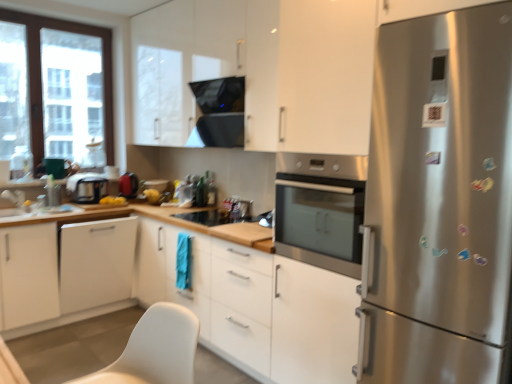
Where is `white plastic table at lower left`? Image resolution: width=512 pixels, height=384 pixels. white plastic table at lower left is located at coordinates (10, 367).

What are the coordinates of `clear glass window at left` in the screenshot? It's located at (45, 74).

Is point (190, 31) positioned after point (35, 225)?

Yes, it is behind point (35, 225).

Is white glossy cabinet at upper center, which ranks as the 1th cabinetry in top-to-bottom order, looking in the opposite direction of white matte cabinet at lower left, marked as the 2th cabinetry in a bottom-to-top arrangement?

white glossy cabinet at upper center, which ranks as the 1th cabinetry in top-to-bottom order, is not turned away from white matte cabinet at lower left, marked as the 2th cabinetry in a bottom-to-top arrangement.

Is white glossy cabinet at upper center, which ranks as the 1th cabinetry in top-to-bottom order, situated inside white matte cabinet at lower left, acting as the third cabinetry starting from the top, or outside?

white glossy cabinet at upper center, which ranks as the 1th cabinetry in top-to-bottom order, is located beyond the bounds of white matte cabinet at lower left, acting as the third cabinetry starting from the top.

From the image's perspective, between black glass exhaust hood at upper center and white glossy sink at lower left, who is located below?

From the image's view, white glossy sink at lower left is below.

Is the surface of black glass exhaust hood at upper center in direct contact with white glossy sink at lower left?

black glass exhaust hood at upper center and white glossy sink at lower left are clearly separated.

Is point (219, 101) behind point (29, 203)?

No, (219, 101) is closer to viewer.

Image resolution: width=512 pixels, height=384 pixels. I want to click on exhaust hood in front of the white glossy sink at lower left, so click(220, 111).

Does white matte cabinet at lower left, acting as the third cabinetry starting from the top, have a lesser height compared to stainless steel oven at center?

In fact, white matte cabinet at lower left, acting as the third cabinetry starting from the top, may be taller than stainless steel oven at center.

Considering the positions of objects white matte cabinet at lower left, acting as the third cabinetry starting from the top, and stainless steel oven at center in the image provided, who is more to the left, white matte cabinet at lower left, acting as the third cabinetry starting from the top, or stainless steel oven at center?

white matte cabinet at lower left, acting as the third cabinetry starting from the top.

From a real-world perspective, which cabinetry is the 1st one underneath the stainless steel oven at center? Please provide its 2D coordinates.

[(71, 273)]

From a real-world perspective, is matte black toaster at left, which is the second appliance from right to left, positioned above or below white matte cabinet at center, the first cabinetry ordered from the bottom?

matte black toaster at left, which is the second appliance from right to left, is above white matte cabinet at center, the first cabinetry ordered from the bottom.

How much distance is there between matte black toaster at left, which is the second appliance from right to left, and white matte cabinet at center, the fourth cabinetry viewed from the top?

A distance of 1.50 meters exists between matte black toaster at left, which is the second appliance from right to left, and white matte cabinet at center, the fourth cabinetry viewed from the top.

Is matte black toaster at left, placed as the first appliance when sorted from left to right, outside of white matte cabinet at center, the first cabinetry ordered from the bottom?

matte black toaster at left, placed as the first appliance when sorted from left to right, is positioned outside white matte cabinet at center, the first cabinetry ordered from the bottom.

Is the position of matte black toaster at left, placed as the first appliance when sorted from left to right, less distant than that of white matte cabinet at center, the first cabinetry ordered from the bottom?

No, it is behind white matte cabinet at center, the first cabinetry ordered from the bottom.

Considering the positions of objects matte black kettle at left, the first appliance viewed from the right, and white plastic table at lower left in the image provided, who is more to the left, matte black kettle at left, the first appliance viewed from the right, or white plastic table at lower left?

Positioned to the left is matte black kettle at left, the first appliance viewed from the right.

Which is in front, matte black kettle at left, the first appliance viewed from the right, or white plastic table at lower left?

Positioned in front is white plastic table at lower left.

Image resolution: width=512 pixels, height=384 pixels. Find the location of `table below the matte black kettle at left, the first appliance viewed from the right (from a real-world perspective)`. table below the matte black kettle at left, the first appliance viewed from the right (from a real-world perspective) is located at coordinates (10, 367).

Is matte black kettle at left, positioned as the second appliance in left-to-right order, shorter than white plastic table at lower left?

No, matte black kettle at left, positioned as the second appliance in left-to-right order, is not shorter than white plastic table at lower left.

From the picture: Is white matte cabinet at center, the fourth cabinetry viewed from the top, located outside white plastic table at lower left?

Indeed, white matte cabinet at center, the fourth cabinetry viewed from the top, is completely outside white plastic table at lower left.

Considering the sizes of white matte cabinet at center, the fourth cabinetry viewed from the top, and white plastic table at lower left in the image, is white matte cabinet at center, the fourth cabinetry viewed from the top, taller or shorter than white plastic table at lower left?

white matte cabinet at center, the fourth cabinetry viewed from the top, is taller than white plastic table at lower left.

Considering the positions of objects white matte cabinet at center, the first cabinetry ordered from the bottom, and white plastic table at lower left in the image provided, who is behind, white matte cabinet at center, the first cabinetry ordered from the bottom, or white plastic table at lower left?

white matte cabinet at center, the first cabinetry ordered from the bottom, is more distant.

From a real-world perspective, is white matte cabinet at center, the fourth cabinetry viewed from the top, on white plastic table at lower left?

No, from a real-world perspective, white matte cabinet at center, the fourth cabinetry viewed from the top, is not above white plastic table at lower left.

From a real-world perspective, which is physically below, stainless steel refrigerator at right or white matte cabinet at lower left, the 2th cabinetry viewed from the top?

white matte cabinet at lower left, the 2th cabinetry viewed from the top.

Is stainless steel refrigerator at right next to white matte cabinet at lower left, the 2th cabinetry viewed from the top?

No, stainless steel refrigerator at right is not in contact with white matte cabinet at lower left, the 2th cabinetry viewed from the top.

Is stainless steel refrigerator at right further to camera compared to white matte cabinet at lower left, which is the 3th cabinetry in bottom-to-top order?

No, stainless steel refrigerator at right is closer to the viewer.

Which cabinetry is the 1st one when counting from the front of the white matte cabinet at lower left, acting as the third cabinetry starting from the top? Please provide its 2D coordinates.

[(180, 63)]

I want to click on sink behind the black glass exhaust hood at upper center, so pyautogui.click(x=15, y=203).

From the image, which object appears to be farther from stainless steel oven at center, black glass exhaust hood at upper center or matte black kettle at left, positioned as the second appliance in left-to-right order?

matte black kettle at left, positioned as the second appliance in left-to-right order, is positioned further to the anchor stainless steel oven at center.

When comparing their distances from white matte cabinet at center, the fourth cabinetry viewed from the top, does white glossy sink at lower left or stainless steel refrigerator at right seem further?

white glossy sink at lower left.

Based on their spatial positions, is matte black kettle at left, the first appliance viewed from the right, or white matte cabinet at center, the fourth cabinetry viewed from the top, closer to white matte cabinet at lower left, acting as the third cabinetry starting from the top?

matte black kettle at left, the first appliance viewed from the right, is closer to white matte cabinet at lower left, acting as the third cabinetry starting from the top.

Which object lies further to the anchor point white glossy cabinet at upper center, which ranks as the 1th cabinetry in top-to-bottom order, white plastic table at lower left or stainless steel refrigerator at right?

Among the two, white plastic table at lower left is located further to white glossy cabinet at upper center, which ranks as the 1th cabinetry in top-to-bottom order.

Considering their positions, is clear glass window at left positioned closer to white matte cabinet at center, the first cabinetry ordered from the bottom, than stainless steel refrigerator at right?

stainless steel refrigerator at right is closer to white matte cabinet at center, the first cabinetry ordered from the bottom.

When comparing their distances from matte black kettle at left, positioned as the second appliance in left-to-right order, does matte black toaster at left, placed as the first appliance when sorted from left to right, or white matte cabinet at lower left, acting as the third cabinetry starting from the top, seem further?

white matte cabinet at lower left, acting as the third cabinetry starting from the top, is positioned further to the anchor matte black kettle at left, positioned as the second appliance in left-to-right order.

Considering their positions, is white glossy cabinet at upper center, which ranks as the 4th cabinetry in bottom-to-top order, positioned closer to black glass exhaust hood at upper center than white matte cabinet at lower left, marked as the 2th cabinetry in a bottom-to-top arrangement?

Among the two, white glossy cabinet at upper center, which ranks as the 4th cabinetry in bottom-to-top order, is located nearer to black glass exhaust hood at upper center.

Estimate the real-world distances between objects in this image. Which object is further from stainless steel refrigerator at right, black glass exhaust hood at upper center or stainless steel oven at center?

Among the two, black glass exhaust hood at upper center is located further to stainless steel refrigerator at right.

Image resolution: width=512 pixels, height=384 pixels. What are the coordinates of `sink that lies between white glossy cabinet at upper center, which ranks as the 1th cabinetry in top-to-bottom order, and white matte cabinet at lower left, which is the 3th cabinetry in bottom-to-top order, from top to bottom` in the screenshot? It's located at (15, 203).

Find the location of `home appliance between white matte cabinet at lower left, which is the 3th cabinetry in bottom-to-top order, and stainless steel refrigerator at right`. home appliance between white matte cabinet at lower left, which is the 3th cabinetry in bottom-to-top order, and stainless steel refrigerator at right is located at coordinates (321, 210).

Where is `exhaust hood between white matte cabinet at center, the first cabinetry ordered from the bottom, and clear glass window at left from front to back`? The image size is (512, 384). exhaust hood between white matte cabinet at center, the first cabinetry ordered from the bottom, and clear glass window at left from front to back is located at coordinates (220, 111).

The width and height of the screenshot is (512, 384). Find the location of `home appliance between white plastic table at lower left and white matte cabinet at lower left, the 2th cabinetry viewed from the top, along the z-axis`. home appliance between white plastic table at lower left and white matte cabinet at lower left, the 2th cabinetry viewed from the top, along the z-axis is located at coordinates (321, 210).